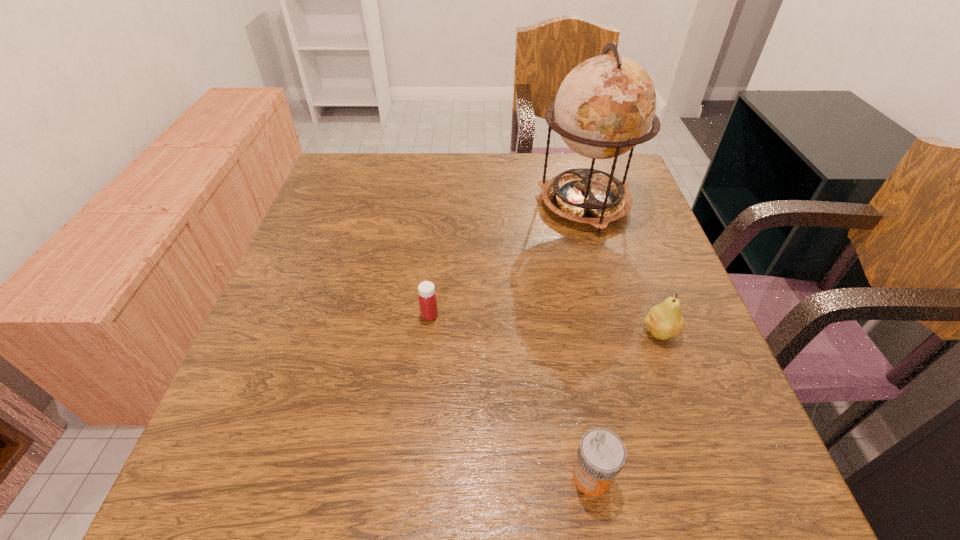
Locate an element on the screen. The width and height of the screenshot is (960, 540). blank space located on the label side of the right medicine is located at coordinates (524, 477).

You are a GUI agent. You are given a task and a screenshot of the screen. Output one action in this format:
    pyautogui.click(x=<x>, y=<y>)
    Task: Click on the free spot located on the label side of the right medicine
    The image size is (960, 540).
    Given the screenshot: What is the action you would take?
    click(511, 477)

Where is `free space located 0.250m on the front of the farther medicine`? The height and width of the screenshot is (540, 960). free space located 0.250m on the front of the farther medicine is located at coordinates (416, 446).

Find the location of `object at the far edge`. object at the far edge is located at coordinates (605, 106).

You are a GUI agent. You are given a task and a screenshot of the screen. Output one action in this format:
    pyautogui.click(x=<x>, y=<y>)
    Task: Click on the object present at the near edge
    
    Given the screenshot: What is the action you would take?
    pyautogui.click(x=601, y=455)

At what (x,y) coordinates should I click in order to perform the action: click on globe at the right edge. Please return your answer as a coordinate pair (x, y). This screenshot has height=540, width=960. Looking at the image, I should click on (605, 106).

The width and height of the screenshot is (960, 540). In order to click on pear that is at the right edge in this screenshot , I will do `click(665, 320)`.

Where is `object at the far right corner`? This screenshot has width=960, height=540. object at the far right corner is located at coordinates (605, 106).

Locate an element on the screen. This screenshot has width=960, height=540. vacant region at the far edge of the desktop is located at coordinates (539, 160).

Where is `free region at the near edge of the desktop`? free region at the near edge of the desktop is located at coordinates (633, 510).